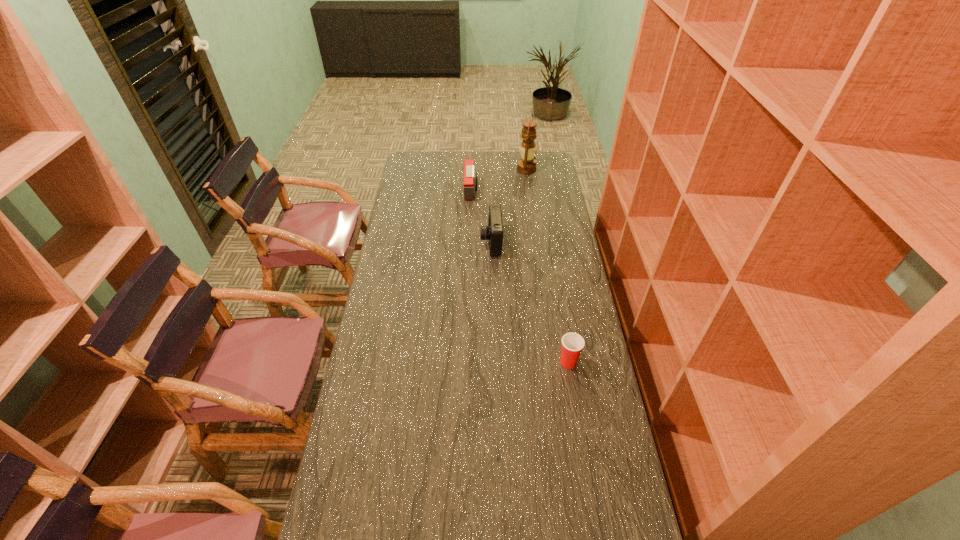
I want to click on oil lamp, so click(x=527, y=165).

The image size is (960, 540). I want to click on the tallest object, so click(x=527, y=165).

At what (x,y) coordinates should I click in order to perform the action: click on the right camera. Please return your answer as a coordinate pair (x, y). This screenshot has width=960, height=540. Looking at the image, I should click on (493, 232).

The image size is (960, 540). I want to click on the second object from left to right, so click(493, 232).

At what (x,y) coordinates should I click in order to perform the action: click on the left camera. Please return your answer as a coordinate pair (x, y). The height and width of the screenshot is (540, 960). Looking at the image, I should click on (470, 176).

Locate an element on the screen. the second farthest object is located at coordinates (470, 176).

Identify the location of Dixie cup. (572, 343).

I want to click on vacant region located on the left of the farthest object, so click(x=470, y=169).

Image resolution: width=960 pixels, height=540 pixels. I want to click on vacant space located on the front-facing side of the second object from left to right, so click(x=459, y=242).

You are a GUI agent. You are given a task and a screenshot of the screen. Output one action in this format:
    pyautogui.click(x=<x>, y=<y>)
    Task: Click on the vacant space located on the front-facing side of the second object from left to right
    
    Given the screenshot: What is the action you would take?
    pyautogui.click(x=389, y=242)